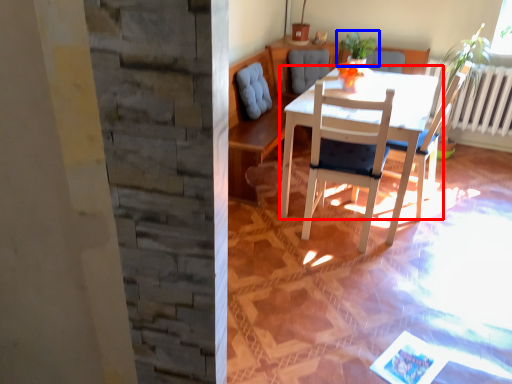
Question: Which object appears closest to the camera in this image, table (highlighted by a red box) or houseplant (highlighted by a blue box)?

Choices:
 (A) table
 (B) houseplant

Answer: (A)